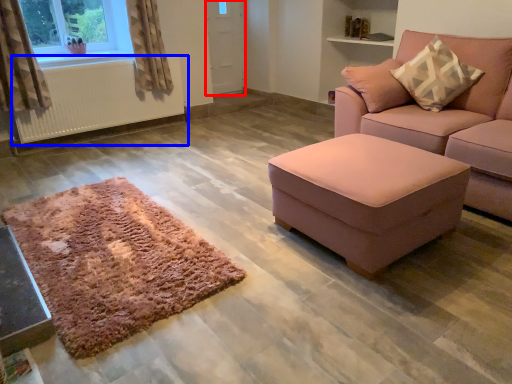
Question: Which object is further to the camera taking this photo, screen door (highlighted by a red box) or radiator (highlighted by a blue box)?

Choices:
 (A) screen door
 (B) radiator

Answer: (A)